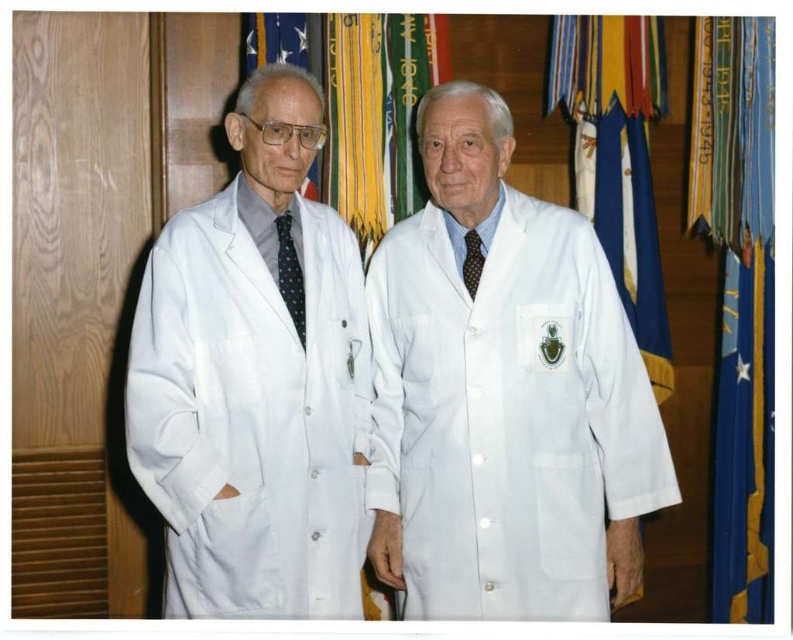
Does point (623, 115) come closer to viewer compared to point (301, 278)?

No, (623, 115) is behind (301, 278).

Can you confirm if blue fabric flag at center is positioned to the left of dark blue dotted tie at center?

Incorrect, blue fabric flag at center is not on the left side of dark blue dotted tie at center.

What do you see at coordinates (617, 157) in the screenshot? Image resolution: width=793 pixels, height=640 pixels. I see `blue fabric flag at center` at bounding box center [617, 157].

In order to click on blue fabric flag at center in this screenshot , I will do point(617,157).

Between point (422, 525) and point (535, 225), which one is positioned behind?

The point (535, 225) is behind.

Is white lab coat at center taller than white matte lab coat at center?

Yes, white lab coat at center is taller than white matte lab coat at center.

Between point (451, 554) and point (460, 232), which one is positioned behind?

The point (460, 232) is behind.

Where is `white lab coat at center`? white lab coat at center is located at coordinates (393, 392).

Who is lower down, white matte lab coat at left or brown dotted tie at center?

white matte lab coat at left

This screenshot has width=793, height=640. Find the location of `white matte lab coat at left`. white matte lab coat at left is located at coordinates (255, 381).

This screenshot has width=793, height=640. I want to click on white matte lab coat at left, so click(255, 381).